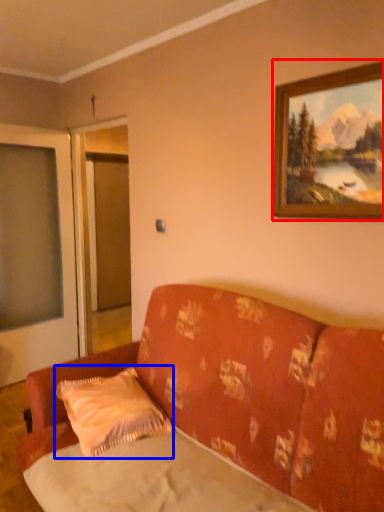
Question: Among these objects, which one is nearest to the camera, picture frame (highlighted by a red box) or pillow (highlighted by a blue box)?

Choices:
 (A) picture frame
 (B) pillow

Answer: (A)